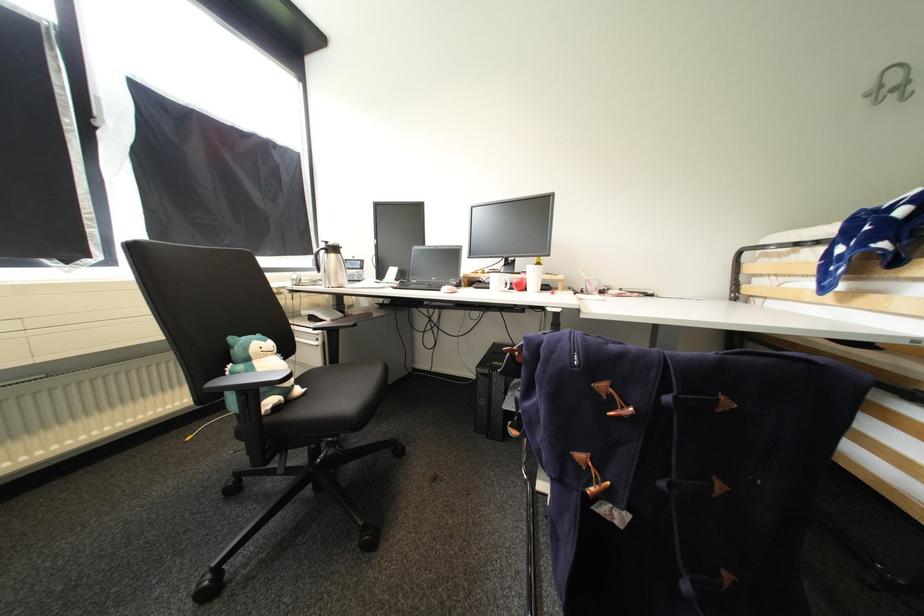
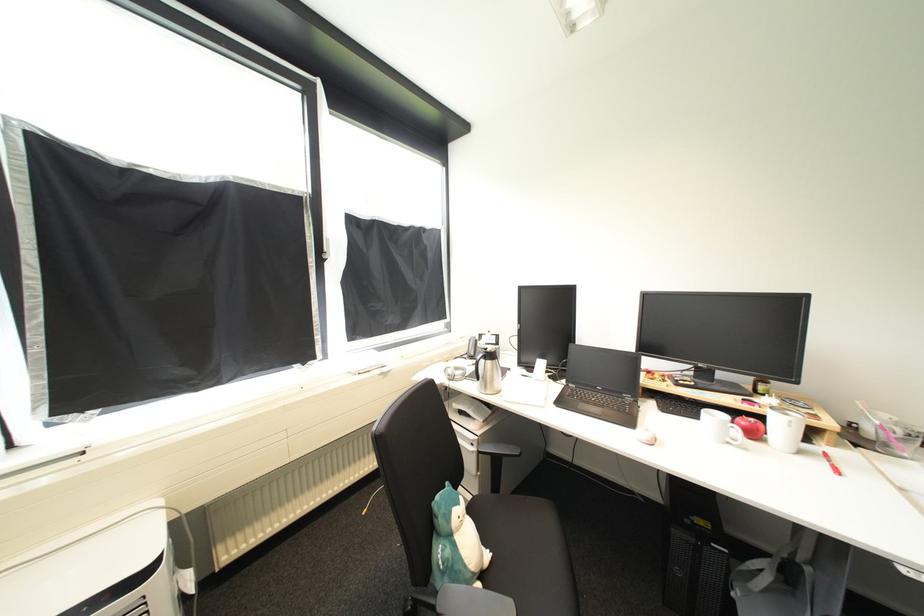
Find the pixel in the second image that matches point (262, 363) in the first image.

(464, 538)